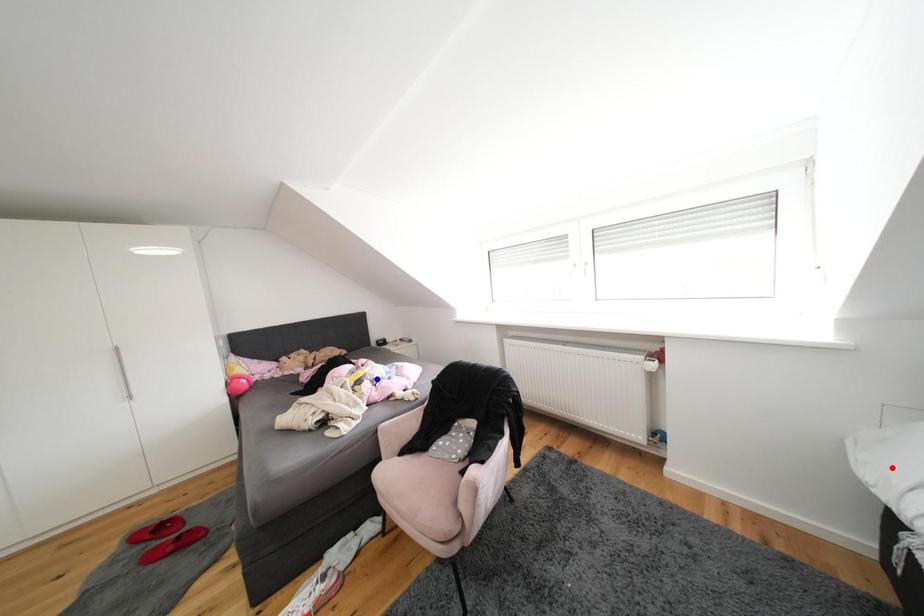
Question: Two points are marked on the image. Which point is closer to the camera?

Choices:
 (A) Blue point is closer.
 (B) Red point is closer.

Answer: (B)